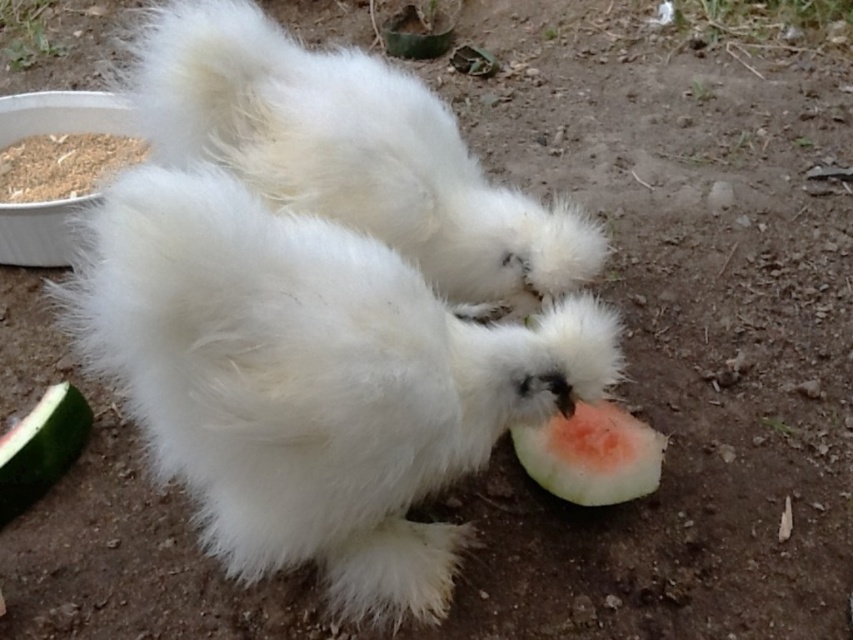
Question: Which point appears closest to the camera in this image?

Choices:
 (A) (38, 449)
 (B) (656, 460)

Answer: (B)

Question: Which object appears farthest from the camera in this image?

Choices:
 (A) green juicy watermelon at lower left
 (B) pink flesh watermelon at lower center

Answer: (A)

Question: Can you confirm if pink flesh watermelon at lower center is positioned above green juicy watermelon at lower left?

Choices:
 (A) no
 (B) yes

Answer: (B)

Question: Can you confirm if pink flesh watermelon at lower center is positioned to the right of green juicy watermelon at lower left?

Choices:
 (A) no
 (B) yes

Answer: (B)

Question: Is pink flesh watermelon at lower center smaller than green juicy watermelon at lower left?

Choices:
 (A) yes
 (B) no

Answer: (B)

Question: Which of the following is the closest to the observer?

Choices:
 (A) (618, 416)
 (B) (44, 426)

Answer: (B)